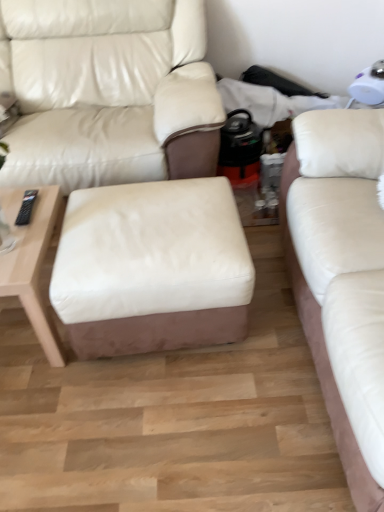
At what (x,y) coordinates should I click in order to perform the action: click on free point in front of white leather ottoman at center. Please return your answer as a coordinate pair (x, y). Looking at the image, I should click on (170, 423).